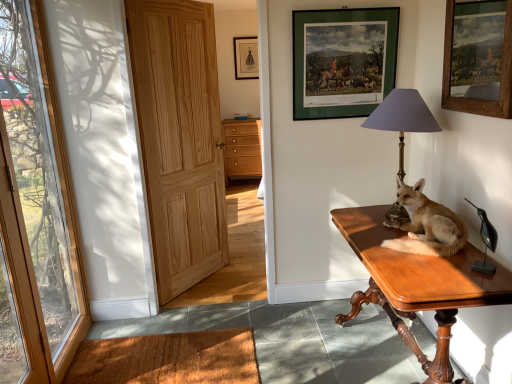
At what (x,y) coordinates should I click in order to perform the action: click on free space in front of brown fur stuffed fox at right. Please return your answer as a coordinate pair (x, y). Image resolution: width=512 pixels, height=384 pixels. Looking at the image, I should click on (440, 275).